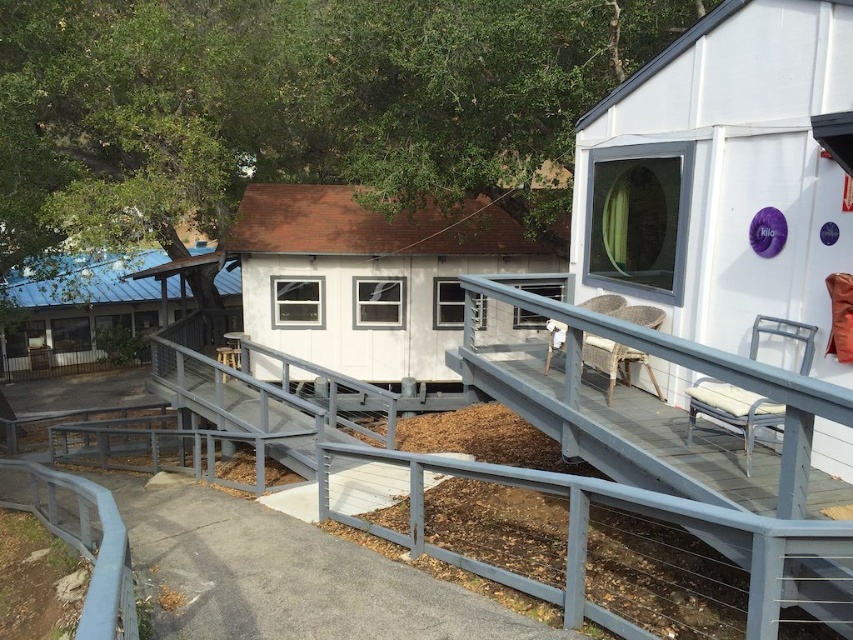
You are standing at the entrance of the small white building with a red roof and want to reach the gray metal rail at center. According to the coordinates provided, in which direction should you move from your current position to reach it?

You should move towards the center of the image since the gray metal rail at center is located at point (653, 412), which is the central area.

You are standing on the deck and want to walk towards the white matte hut at upper right and the gray metal rail at center. Which object will you encounter first?

You will encounter the gray metal rail at center first because it is closer to you than the white matte hut at upper right, which is further away.

You are planning to place a large dining table that requires 10 meters of space. You see the white matte hut at upper right and the white wood cabin at center. Which structure has enough space for the table?

The white wood cabin at center has a greater width than the white matte hut at upper right, so it is more likely to have enough space for the large dining table requiring 10 meters.